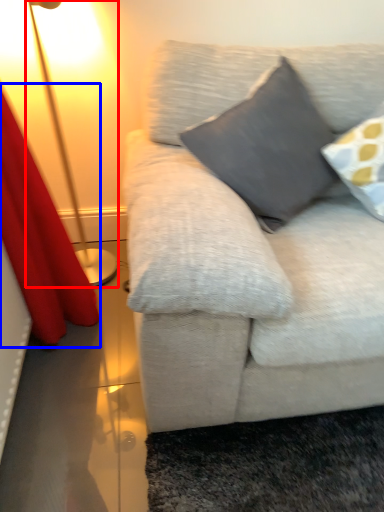
Question: Which point is closer to the camera, lamp (highlighted by a red box) or curtain (highlighted by a blue box)?

Choices:
 (A) lamp
 (B) curtain

Answer: (B)